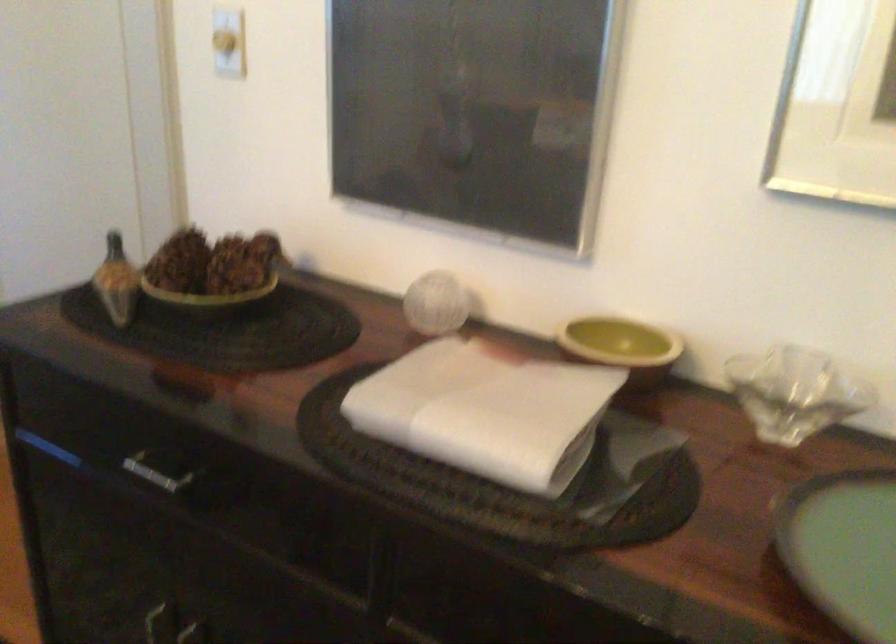
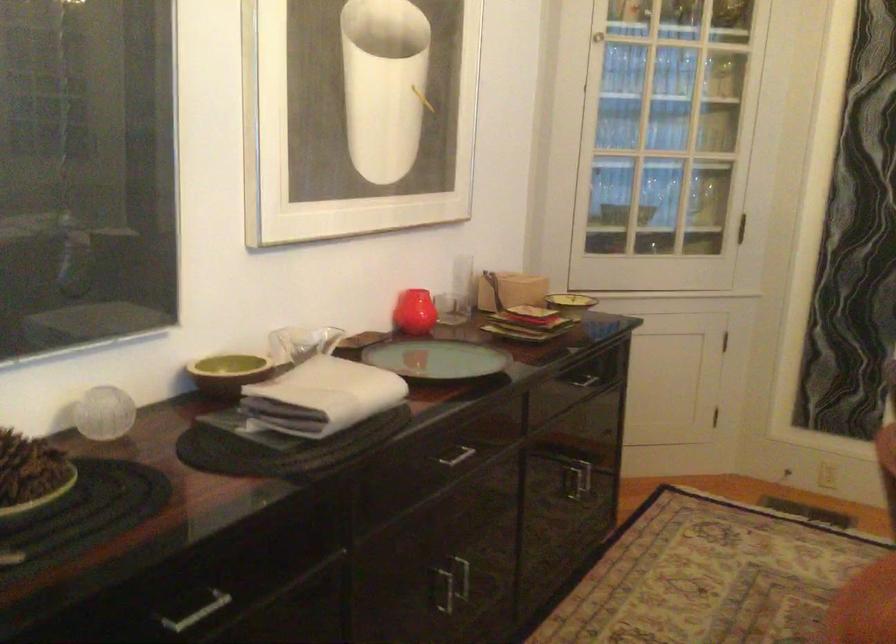
The point at (205, 486) is marked in the first image. Where is the corresponding point in the second image?

(194, 609)